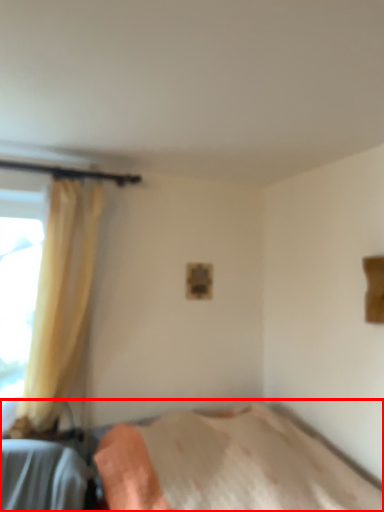
Question: Observing the image, what is the correct spatial positioning of bed (annotated by the red box) in reference to curtain?

Choices:
 (A) right
 (B) left

Answer: (A)